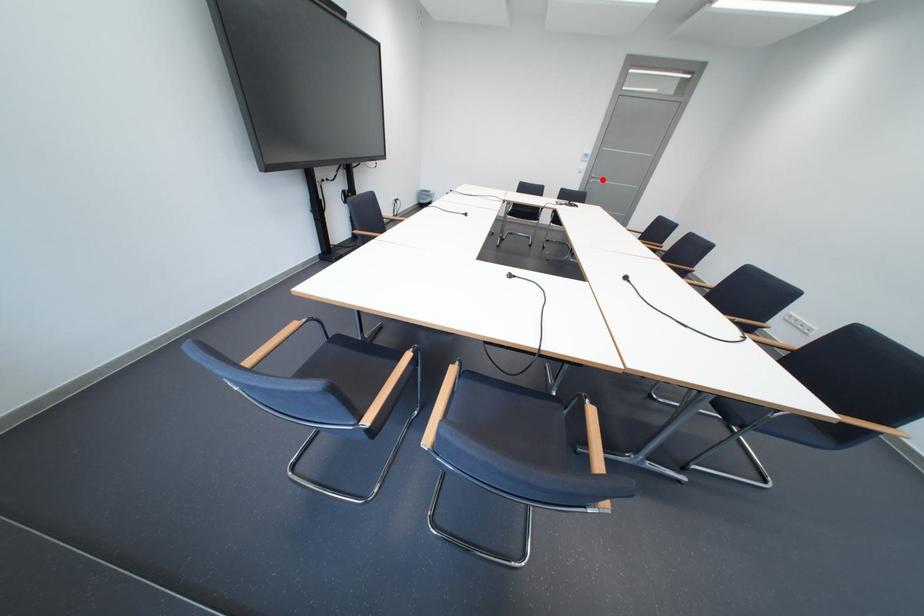
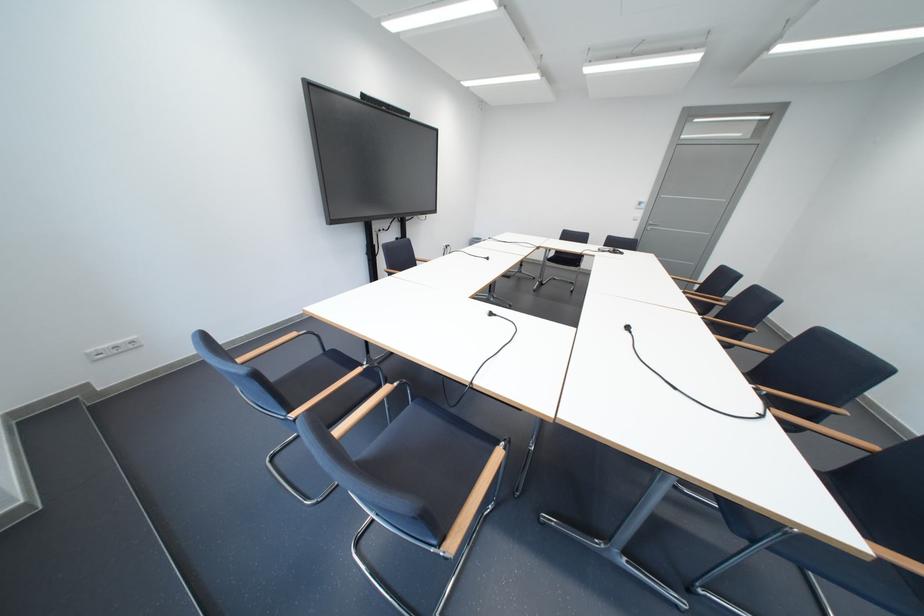
The point at the highlighted location is marked in the first image. Where is the corresponding point in the second image?

(660, 227)